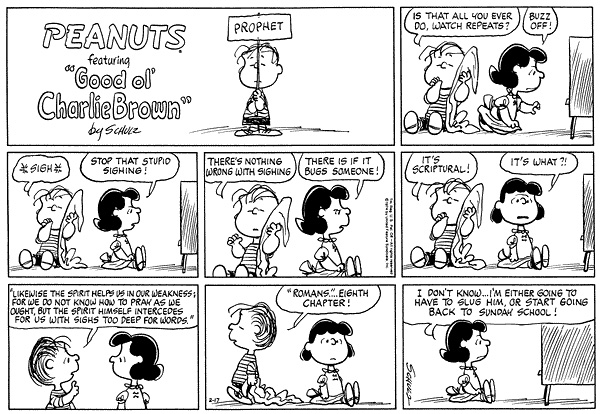
Identify the location of blanket. (472, 68), (75, 204), (276, 213), (475, 201), (269, 400).